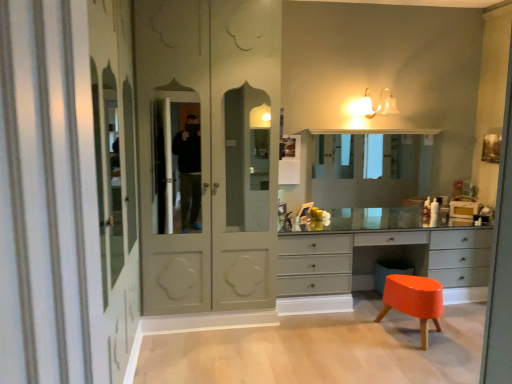
Identify the location of free location in front of orange glossy stool at lower right. This screenshot has width=512, height=384. (443, 369).